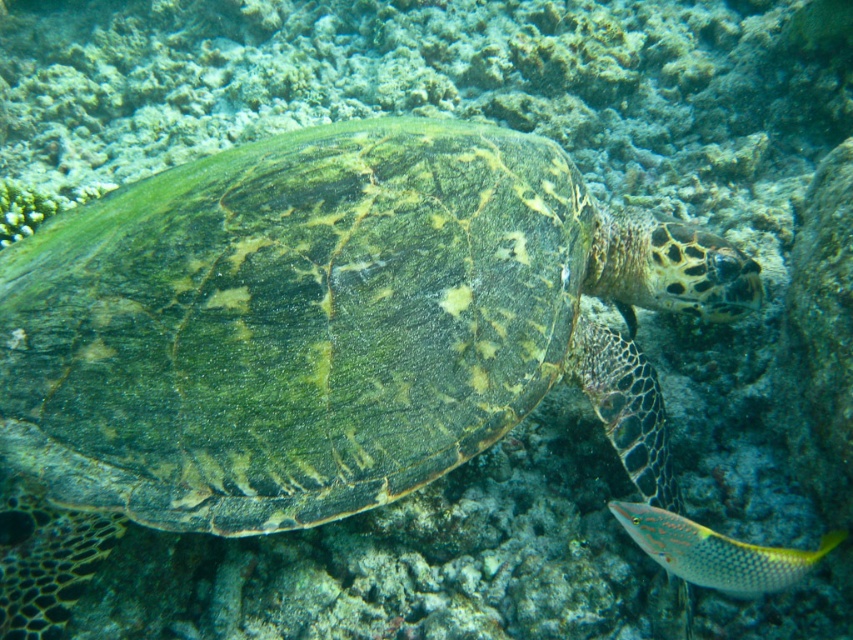
Question: Which object is farther from the camera taking this photo?

Choices:
 (A) shiny yellow fish at lower right
 (B) green textured shell at center

Answer: (B)

Question: Which of the following is the closest to the observer?

Choices:
 (A) (210, 452)
 (B) (735, 566)

Answer: (B)

Question: Is green textured shell at center to the right of shiny yellow fish at lower right from the viewer's perspective?

Choices:
 (A) no
 (B) yes

Answer: (A)

Question: Considering the relative positions of green textured shell at center and shiny yellow fish at lower right in the image provided, where is green textured shell at center located with respect to shiny yellow fish at lower right?

Choices:
 (A) right
 (B) left

Answer: (B)

Question: Is green textured shell at center thinner than shiny yellow fish at lower right?

Choices:
 (A) no
 (B) yes

Answer: (A)